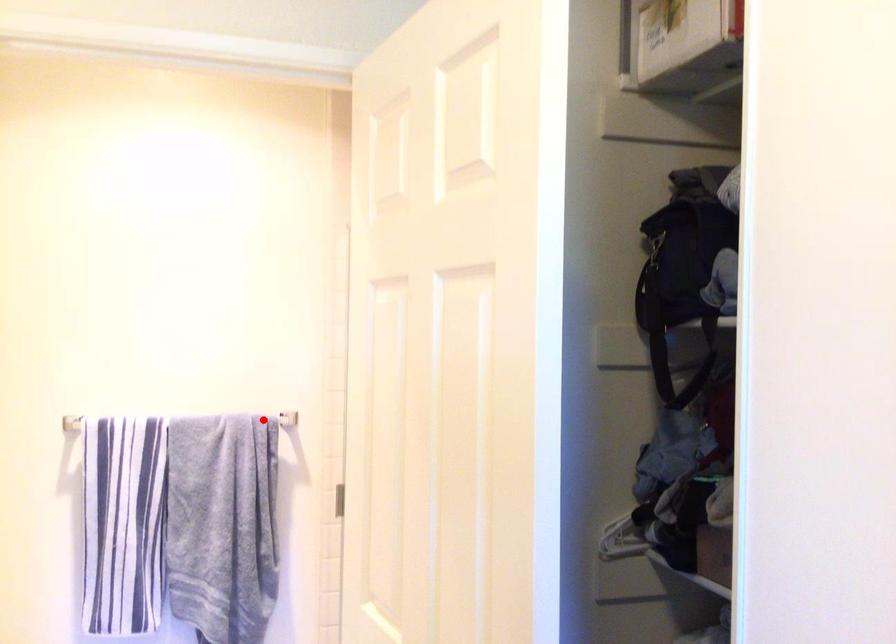
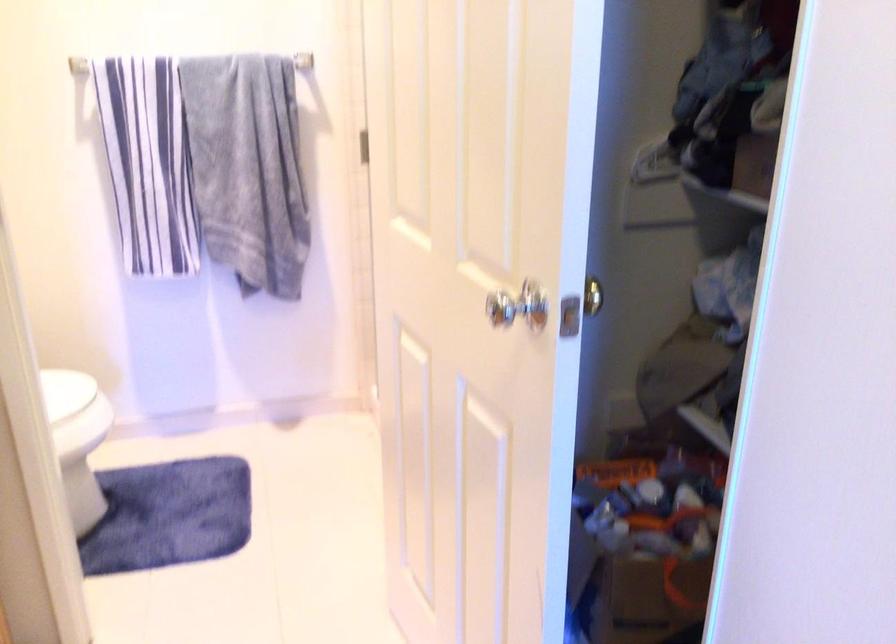
The point at the highlighted location is marked in the first image. Where is the corresponding point in the second image?

(281, 62)